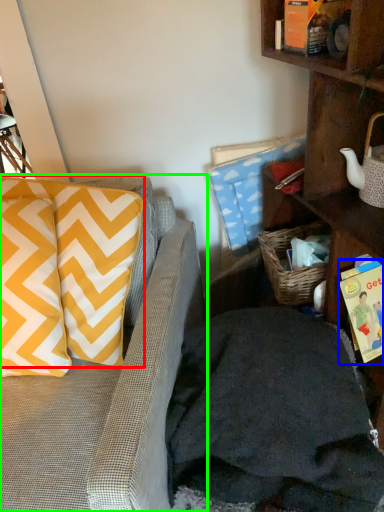
Question: Which object is the farthest from pillow (highlighted by a red box)? Choose among these: book (highlighted by a blue box) or studio couch (highlighted by a green box).

Choices:
 (A) book
 (B) studio couch

Answer: (A)